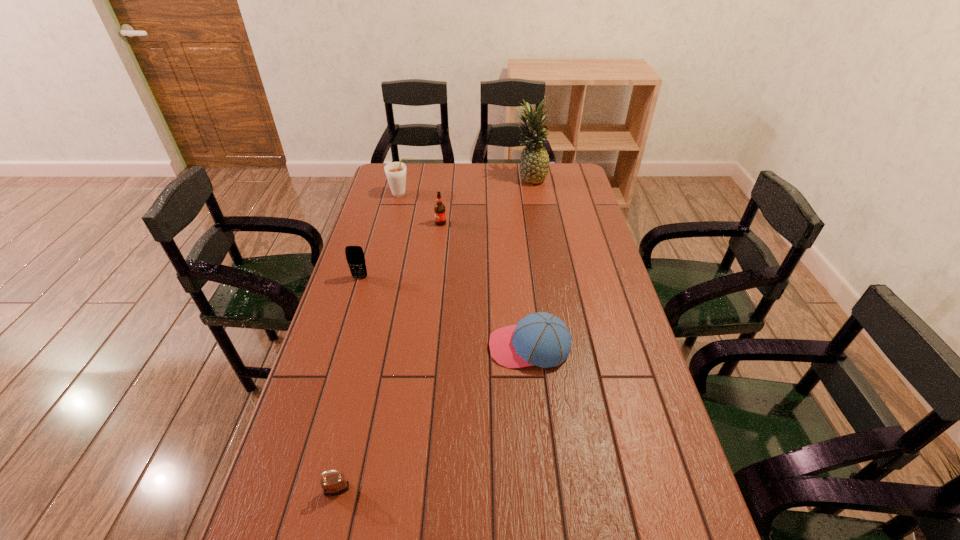
Identify the location of root beer present at the far edge. This screenshot has width=960, height=540. (395, 172).

Identify the location of root beer at the left edge. This screenshot has width=960, height=540. (395, 172).

Identify the location of cellular telephone that is at the left edge. The height and width of the screenshot is (540, 960). (355, 257).

What are the coordinates of `padlock that is at the left edge` in the screenshot? It's located at (334, 484).

The image size is (960, 540). I want to click on object present at the right edge, so click(534, 163).

Identify the location of object located in the far left corner section of the desktop. The height and width of the screenshot is (540, 960). (395, 172).

Identify the location of object at the far right corner. The image size is (960, 540). (534, 163).

In the image, there is a desktop. In order to click on vacant space at the left edge in this screenshot , I will do `click(371, 231)`.

Where is `free point at the right edge`? The width and height of the screenshot is (960, 540). free point at the right edge is located at coordinates (587, 208).

Locate an element on the screen. vacant space at the far right corner of the desktop is located at coordinates (576, 181).